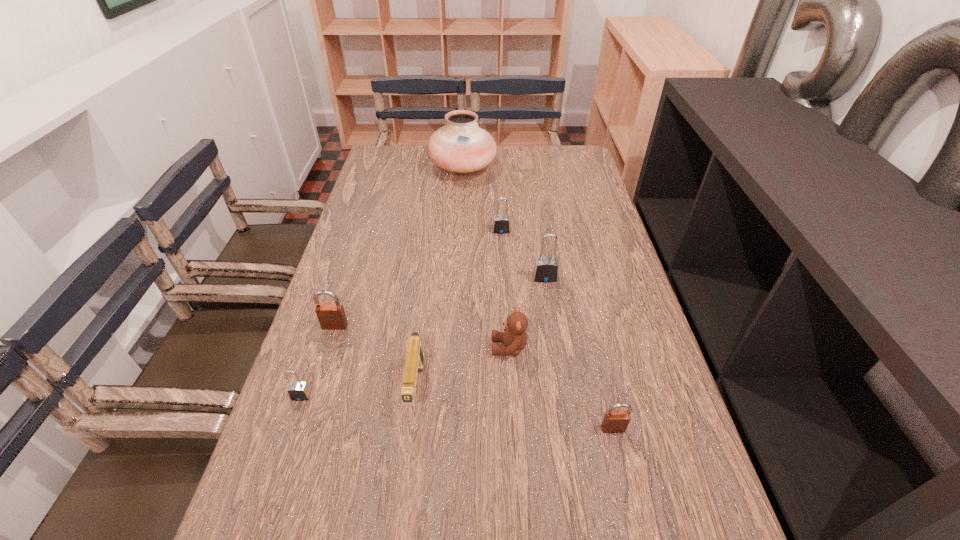
What are the coordinates of `empty space between the rightmost object and the farther brown padlock` in the screenshot? It's located at (474, 377).

The image size is (960, 540). Find the location of `vacant region between the pistol and the fifth nearest object`. vacant region between the pistol and the fifth nearest object is located at coordinates (375, 357).

Locate an element on the screen. The width and height of the screenshot is (960, 540). free spot between the leftmost gray padlock and the tan pistol is located at coordinates (359, 392).

This screenshot has height=540, width=960. Identify the location of unoccupied area between the third padlock from right to left and the smaller brown padlock. (557, 329).

Locate an element on the screen. free space between the teddy bear and the rightmost gray padlock is located at coordinates (527, 313).

The height and width of the screenshot is (540, 960). What are the coordinates of `vacant space that is in between the fourth farthest object and the teddy bear` in the screenshot? It's located at (422, 336).

Where is `vacant space that is in between the smallest gray padlock and the smaller brown padlock`? This screenshot has height=540, width=960. vacant space that is in between the smallest gray padlock and the smaller brown padlock is located at coordinates (457, 412).

Locate an element on the screen. unoccupied position between the third padlock from right to left and the bigger brown padlock is located at coordinates coord(418,278).

You are a GUI agent. You are given a task and a screenshot of the screen. Output one action in this format:
    pyautogui.click(x=<x>, y=<y>)
    Task: Click on the vacant region between the fifth nearest object and the fourth nearest padlock
    This screenshot has height=540, width=960.
    Given the screenshot: What is the action you would take?
    pyautogui.click(x=440, y=302)

The image size is (960, 540). Identify the location of vacant space that is in between the second farthest object and the fourth farthest padlock. (401, 313).